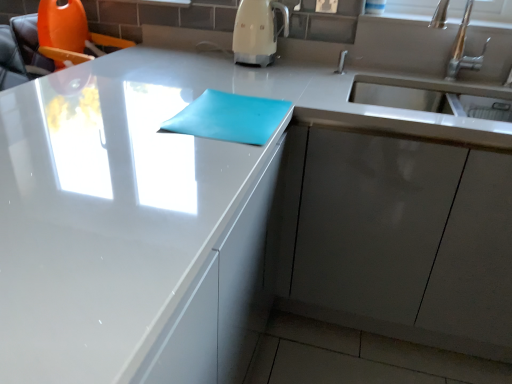
This screenshot has width=512, height=384. I want to click on matte gray cabinet at lower right, so click(404, 241).

Describe the element at coordinates (404, 241) in the screenshot. The image size is (512, 384). I see `matte gray cabinet at lower right` at that location.

Locate an element on the screen. matte gray cabinet at lower right is located at coordinates (404, 241).

Between point (269, 2) and point (242, 98), which one is positioned behind?

Positioned behind is point (269, 2).

Are white glossy coffee machine at upper center and matte blue notepad at center located far from each other?

No, white glossy coffee machine at upper center is not far from matte blue notepad at center.

Is white glossy coffee machine at upper center positioned before matte blue notepad at center?

No, white glossy coffee machine at upper center is behind matte blue notepad at center.

Between matte blue notepad at center and matte gray cabinet at lower right, which one has larger size?

matte gray cabinet at lower right is bigger.

From the picture: Does matte blue notepad at center turn towards matte gray cabinet at lower right?

No, matte blue notepad at center is not turned towards matte gray cabinet at lower right.

Is matte blue notepad at center thinner than matte gray cabinet at lower right?

Yes.

In the image, is matte blue notepad at center positioned in front of or behind matte gray cabinet at lower right?

matte blue notepad at center is positioned closer to the viewer than matte gray cabinet at lower right.

Looking at this image, is there a large distance between matte blue notepad at center and white glossy coffee machine at upper center?

No, matte blue notepad at center is in close proximity to white glossy coffee machine at upper center.

This screenshot has width=512, height=384. In the image, there is a white glossy coffee machine at upper center. In order to click on notepad below it (from the image's perspective) in this screenshot , I will do `click(229, 118)`.

Which object is further away from the camera taking this photo, matte blue notepad at center or white glossy coffee machine at upper center?

white glossy coffee machine at upper center is more distant.

From their relative heights in the image, would you say white glossy coffee machine at upper center is taller or shorter than matte gray cabinet at lower right?

Considering their sizes, white glossy coffee machine at upper center has less height than matte gray cabinet at lower right.

From a real-world perspective, who is located lower, white glossy coffee machine at upper center or matte gray cabinet at lower right?

matte gray cabinet at lower right is physically lower.

Do you think white glossy coffee machine at upper center is within matte gray cabinet at lower right, or outside of it?

white glossy coffee machine at upper center is not enclosed by matte gray cabinet at lower right.

Between white glossy coffee machine at upper center and matte gray cabinet at lower right, which one is positioned behind?

white glossy coffee machine at upper center is behind.

From the image's perspective, is matte gray cabinet at lower right above white glossy coffee machine at upper center?

No, from the image's perspective, matte gray cabinet at lower right is not over white glossy coffee machine at upper center.

Which object is positioned more to the right, matte gray cabinet at lower right or white glossy coffee machine at upper center?

matte gray cabinet at lower right is more to the right.

You are a GUI agent. You are given a task and a screenshot of the screen. Output one action in this format:
    pyautogui.click(x=<x>, y=<y>)
    Task: Click on the cabinetry below the white glossy coffee machine at upper center (from the image's perspective)
    This screenshot has width=512, height=384.
    Given the screenshot: What is the action you would take?
    pyautogui.click(x=404, y=241)

From a real-world perspective, is matte gray cabinet at lower right above or below white glossy coffee machine at upper center?

matte gray cabinet at lower right is situated lower than white glossy coffee machine at upper center in the real world.

Looking at this image, how many degrees apart are the facing directions of matte gray cabinet at lower right and matte blue notepad at center?

They differ by 1.54 degrees in their facing directions.

Is matte gray cabinet at lower right facing away from matte blue notepad at center?

No.

Which is closer to the camera, (457, 314) or (190, 107)?

Point (457, 314) is farther from the camera than point (190, 107).

Is matte gray cabinet at lower right bigger than matte blue notepad at center?

Yes.

The image size is (512, 384). Identify the location of notepad in front of the white glossy coffee machine at upper center. point(229,118).

Identify the location of notepad above the matte gray cabinet at lower right (from a real-world perspective). (229, 118).

Looking at the image, which one is located further to matte blue notepad at center, matte gray cabinet at lower right or white glossy coffee machine at upper center?

The object further to matte blue notepad at center is white glossy coffee machine at upper center.

Considering their positions, is matte gray cabinet at lower right positioned closer to white glossy coffee machine at upper center than matte blue notepad at center?

Based on the image, matte blue notepad at center appears to be nearer to white glossy coffee machine at upper center.

When comparing their distances from matte gray cabinet at lower right, does white glossy coffee machine at upper center or matte blue notepad at center seem further?

white glossy coffee machine at upper center.

From the image, which object appears to be nearer to white glossy coffee machine at upper center, matte blue notepad at center or matte gray cabinet at lower right?

The object closer to white glossy coffee machine at upper center is matte blue notepad at center.

Estimate the real-world distances between objects in this image. Which object is further from matte gray cabinet at lower right, matte blue notepad at center or white glossy coffee machine at upper center?

white glossy coffee machine at upper center.

Which object lies nearer to the anchor point matte blue notepad at center, white glossy coffee machine at upper center or matte gray cabinet at lower right?

matte gray cabinet at lower right lies closer to matte blue notepad at center than the other object.

You are a GUI agent. You are given a task and a screenshot of the screen. Output one action in this format:
    pyautogui.click(x=<x>, y=<y>)
    Task: Click on the coffee machine between matte blue notepad at center and matte gray cabinet at lower right in the horizontal direction
    The width and height of the screenshot is (512, 384).
    Given the screenshot: What is the action you would take?
    pyautogui.click(x=257, y=31)